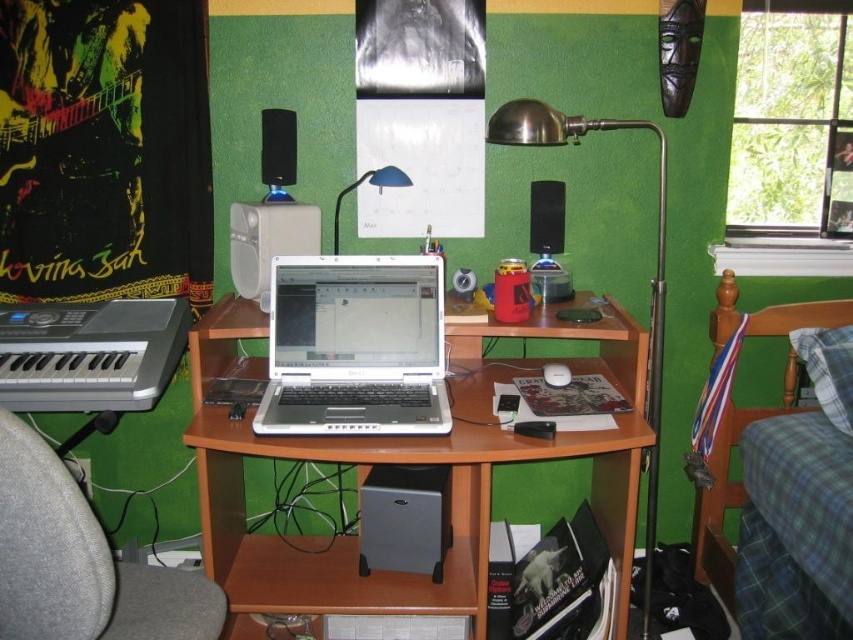
Does silver metallic laptop at center have a lesser height compared to black plastic speaker at center?

No.

Who is taller, silver metallic laptop at center or black plastic speaker at center?

silver metallic laptop at center is taller.

Based on the photo, who is more distant from viewer, (368, 294) or (544, 184)?

Positioned behind is point (544, 184).

At what (x,y) coordinates should I click in order to perform the action: click on silver metallic laptop at center. Please return your answer as a coordinate pair (x, y). Looking at the image, I should click on (355, 348).

Based on the photo, is wooden computer desk at center in front of blue metallic desk lamp at upper center?

That is True.

Is point (354, 458) farther from camera compared to point (338, 212)?

No, (354, 458) is in front of (338, 212).

Is point (407, 577) positioned behind point (384, 179)?

Yes, it is behind point (384, 179).

Identify the location of wooden computer desk at center. (410, 461).

Is gray fabric swivel chair at left taller than blue metallic desk lamp at upper center?

Yes.

Is gray fabric swivel chair at left closer to the viewer compared to blue metallic desk lamp at upper center?

Yes, gray fabric swivel chair at left is in front of blue metallic desk lamp at upper center.

The width and height of the screenshot is (853, 640). What are the coordinates of `gray fabric swivel chair at left` in the screenshot? It's located at (80, 561).